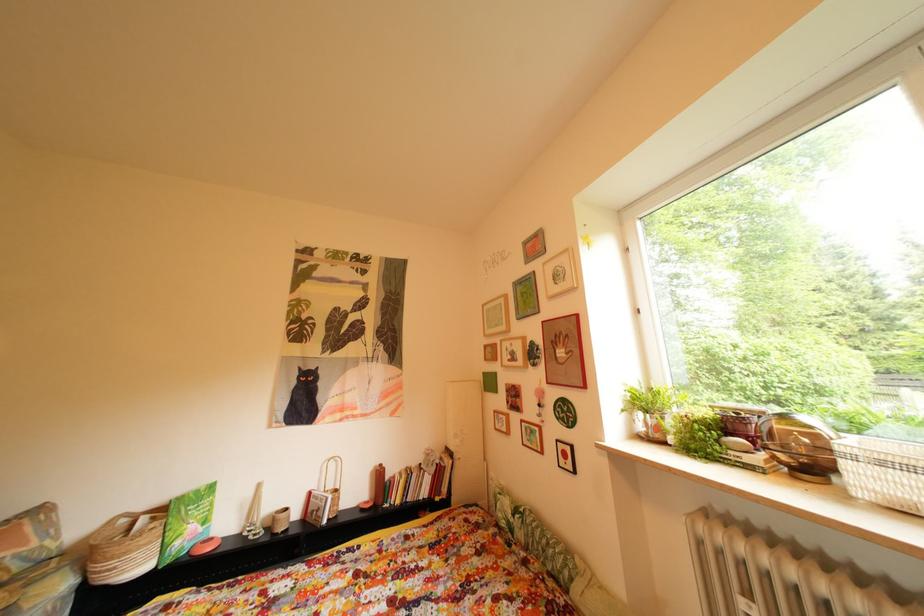
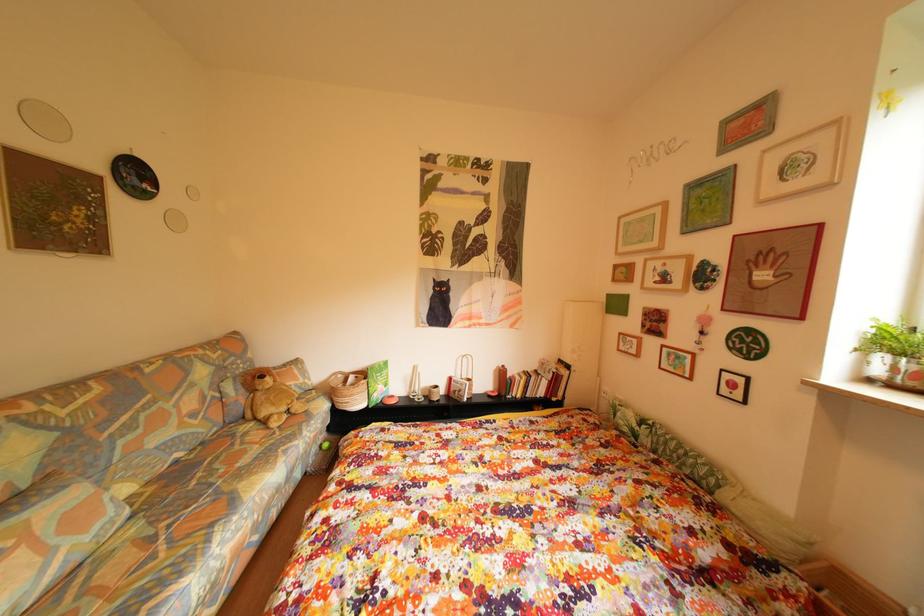
Looking at this image, first-person continuous shooting, in which direction is the camera rotating?

The rotation direction of the camera is left-down.